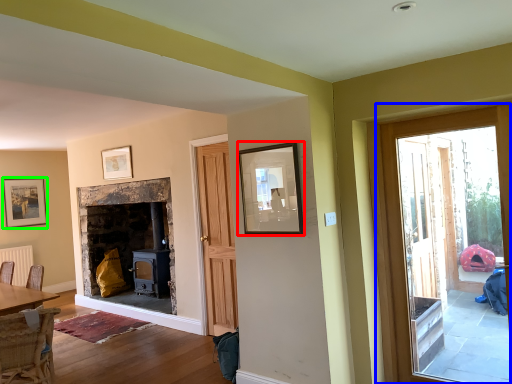
Question: Considering the real-world distances, which object is closest to picture frame (highlighted by a red box)? door (highlighted by a blue box) or picture frame (highlighted by a green box).

Choices:
 (A) door
 (B) picture frame

Answer: (A)